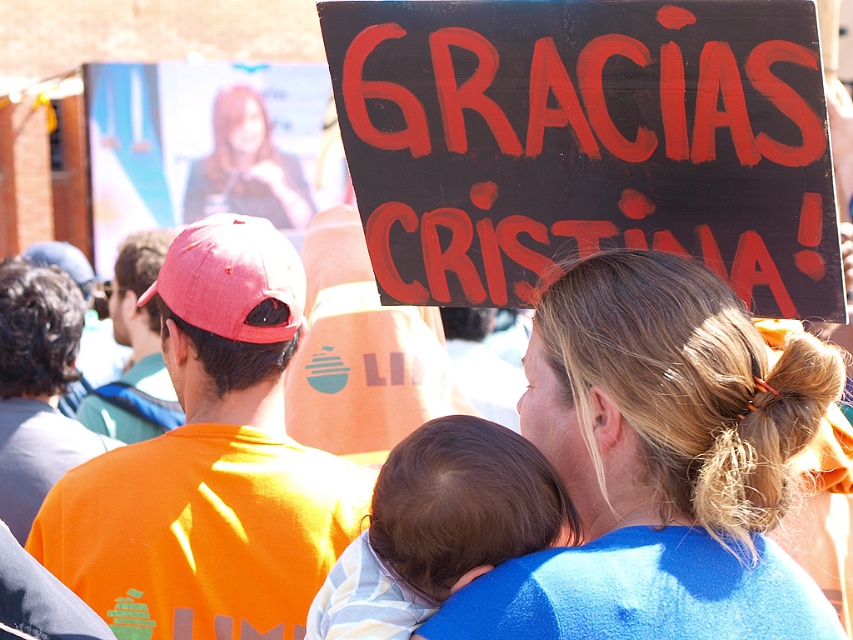
Question: Is blonde hair at upper center below soft white fabric at center?

Choices:
 (A) no
 (B) yes

Answer: (A)

Question: Does blonde hair at upper center have a smaller size compared to soft white fabric at center?

Choices:
 (A) yes
 (B) no

Answer: (B)

Question: Which of the following is the farthest from the observer?

Choices:
 (A) blonde hair at upper center
 (B) soft white fabric at center

Answer: (B)

Question: Which of the following is the farthest from the observer?

Choices:
 (A) (532, 428)
 (B) (548, 534)

Answer: (A)

Question: Can you confirm if blonde hair at upper center is thinner than soft white fabric at center?

Choices:
 (A) yes
 (B) no

Answer: (B)